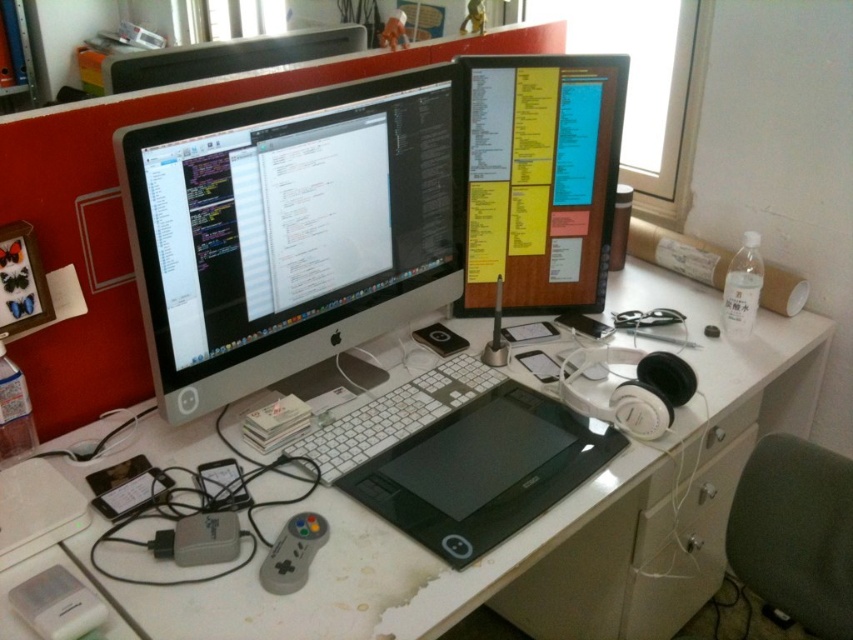
Between sleek silver monitor at center and white matte keyboard at center, which one appears on the right side from the viewer's perspective?

white matte keyboard at center is more to the right.

Which of these two, sleek silver monitor at center or white matte keyboard at center, stands taller?

With more height is sleek silver monitor at center.

Locate an element on the screen. The width and height of the screenshot is (853, 640). sleek silver monitor at center is located at coordinates coord(289,228).

Where is `woodenobject at upper center`? woodenobject at upper center is located at coordinates (540, 179).

Which is more to the left, white plastic computer desk at center or woodenobject at upper center?

white plastic computer desk at center is more to the left.

Measure the distance between white plastic computer desk at center and camera.

white plastic computer desk at center is 34.91 inches from camera.

Who is more distant from viewer, [305,589] or [524,218]?

Positioned behind is point [524,218].

Identify the location of white plastic computer desk at center. pyautogui.click(x=343, y=572).